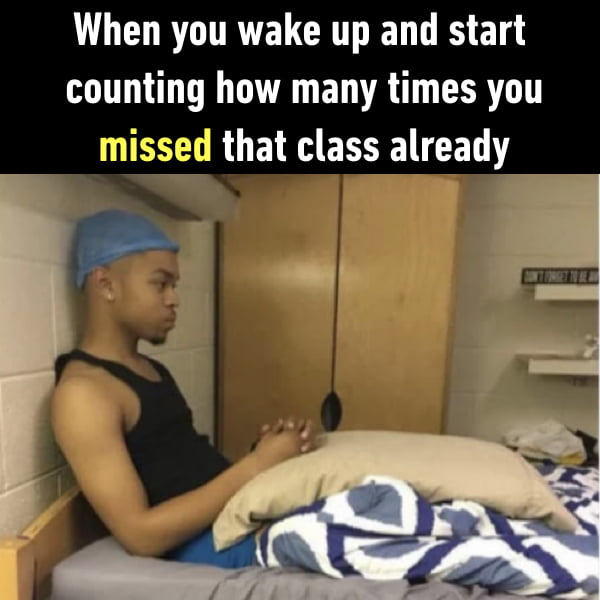
Where is `brown cabinet`? The height and width of the screenshot is (600, 600). brown cabinet is located at coordinates (412, 220).